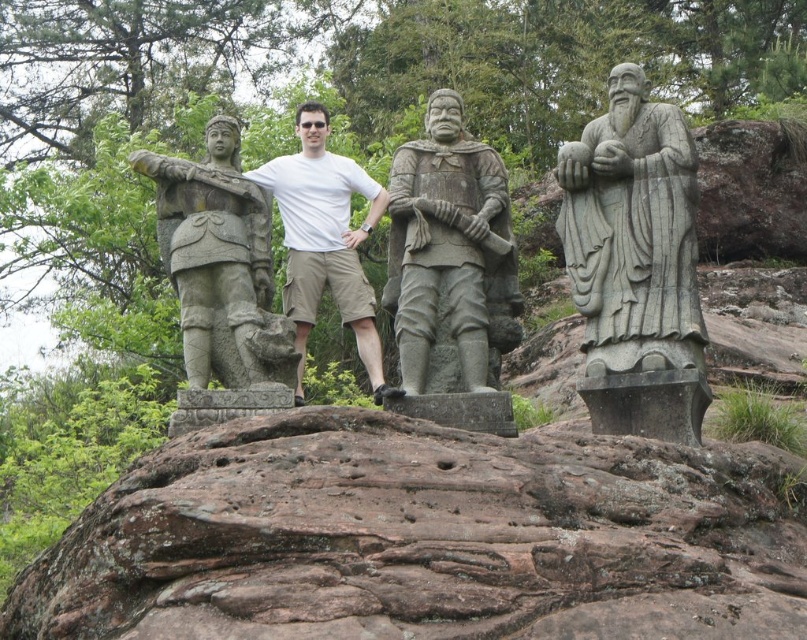
You are a hiker who wants to place a small backpack on the brown stone rock at center and the gray stone hand at center. Which object allows you to place the backpack without it falling off?

The brown stone rock at center allows placing the backpack without it falling off because it is positioned on the left side of the gray stone hand at center, providing a stable surface.

Consider the image. You are a hiker who has reached the top of a rocky outcrop and sees the stone warrior at left and the white matte shirt at center. Which object is higher up on the rock formation?

The stone warrior at left is positioned under the white matte shirt at center, so the white matte shirt at center is higher up on the rock formation.

You are an archaeologist examining the statues. You notice the white matte shirt at center and the matte stone hand at center. Which object is located to the left of the other?

The white matte shirt at center is positioned on the left side of the matte stone hand at center.